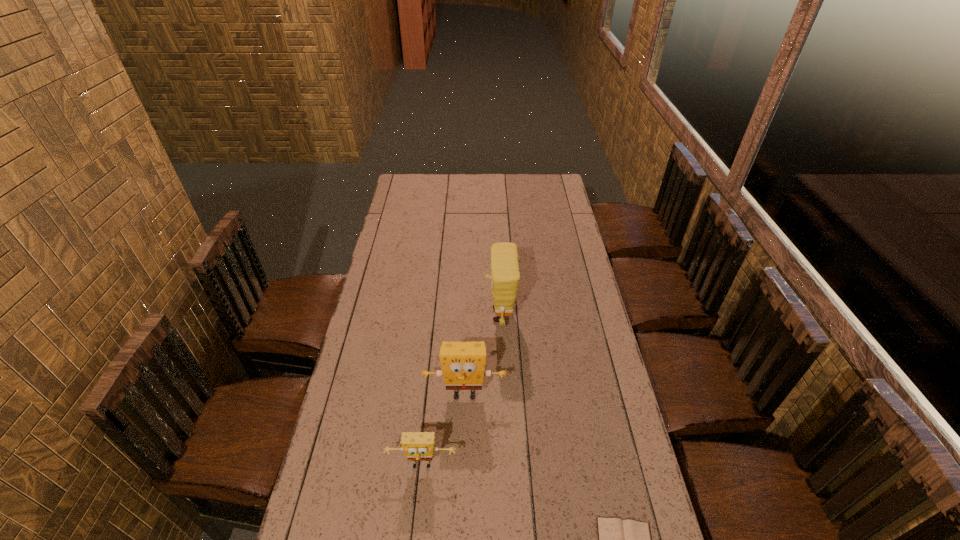
Where is `vacant space located 0.100m on the face of the nearest sponge`? The width and height of the screenshot is (960, 540). vacant space located 0.100m on the face of the nearest sponge is located at coordinates (417, 516).

This screenshot has height=540, width=960. In the image, there is a desktop. What are the coordinates of `free space at the far edge` in the screenshot? It's located at (470, 179).

In the image, there is a desktop. Where is `vacant space at the left edge`? vacant space at the left edge is located at coordinates (334, 528).

The height and width of the screenshot is (540, 960). In the image, there is a desktop. Find the location of `blank space at the right edge`. blank space at the right edge is located at coordinates (556, 286).

Where is `vacant space at the far right corner of the desktop`? This screenshot has width=960, height=540. vacant space at the far right corner of the desktop is located at coordinates (554, 186).

Where is `free spot between the farthest sponge and the second nearest object`? This screenshot has height=540, width=960. free spot between the farthest sponge and the second nearest object is located at coordinates (461, 391).

This screenshot has width=960, height=540. In order to click on vacant space in between the tallest sponge and the shortest sponge in this screenshot , I will do `click(461, 391)`.

You are a GUI agent. You are given a task and a screenshot of the screen. Output one action in this format:
    pyautogui.click(x=<x>, y=<y>)
    Task: Click on the empty space that is in between the second shortest sponge and the shortest sponge
    This screenshot has width=960, height=540.
    Given the screenshot: What is the action you would take?
    pyautogui.click(x=444, y=431)

At what (x,y) coordinates should I click in order to perform the action: click on vacant space that's between the third farthest object and the second farthest sponge. Please return your answer as a coordinate pair (x, y). The height and width of the screenshot is (540, 960). Looking at the image, I should click on (444, 431).

You are a GUI agent. You are given a task and a screenshot of the screen. Output one action in this format:
    pyautogui.click(x=<x>, y=<y>)
    Task: Click on the free space that is in between the farthest sponge and the nearest sponge
    
    Given the screenshot: What is the action you would take?
    pyautogui.click(x=461, y=391)